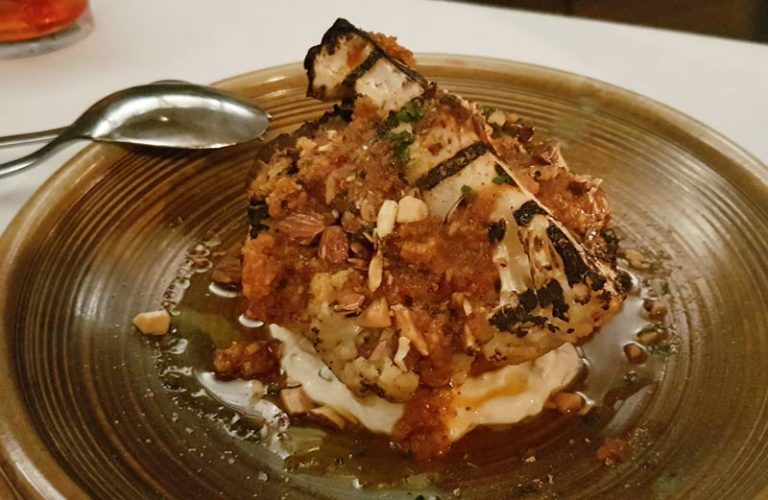
You are a GUI agent. You are given a task and a screenshot of the screen. Output one action in this format:
    pyautogui.click(x=<x>, y=<y>)
    Task: Click on the brown colored dinner plate
    Image resolution: width=768 pixels, height=500 pixels.
    Given the screenshot: What is the action you would take?
    pyautogui.click(x=88, y=314)